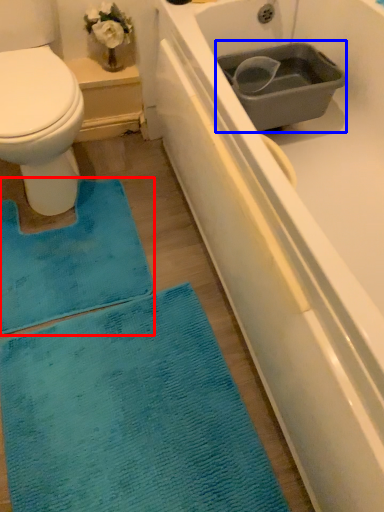
Question: Among these objects, which one is farthest to the camera, doormat (highlighted by a red box) or sink (highlighted by a blue box)?

Choices:
 (A) doormat
 (B) sink

Answer: (B)